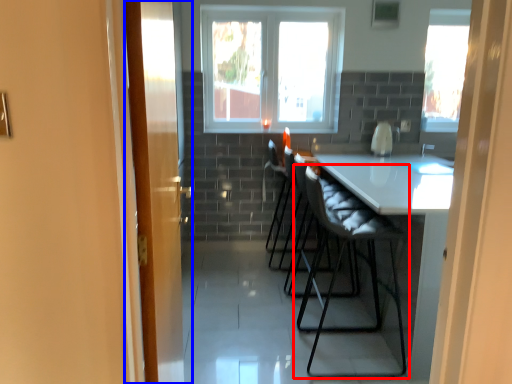
Question: Which point is further to the camera, chair (highlighted by a red box) or door (highlighted by a blue box)?

Choices:
 (A) chair
 (B) door

Answer: (A)